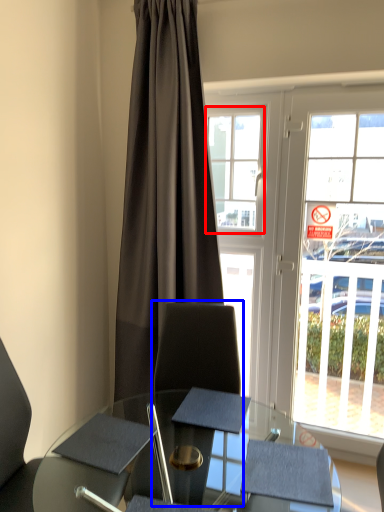
Question: Which object is further to the camera taking this photo, bay window (highlighted by a red box) or swivel chair (highlighted by a blue box)?

Choices:
 (A) bay window
 (B) swivel chair

Answer: (A)